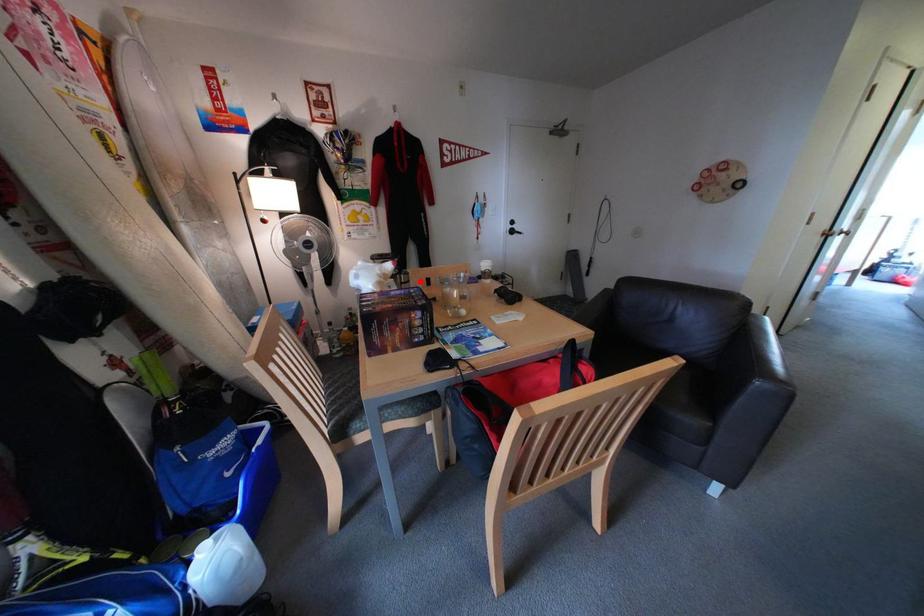
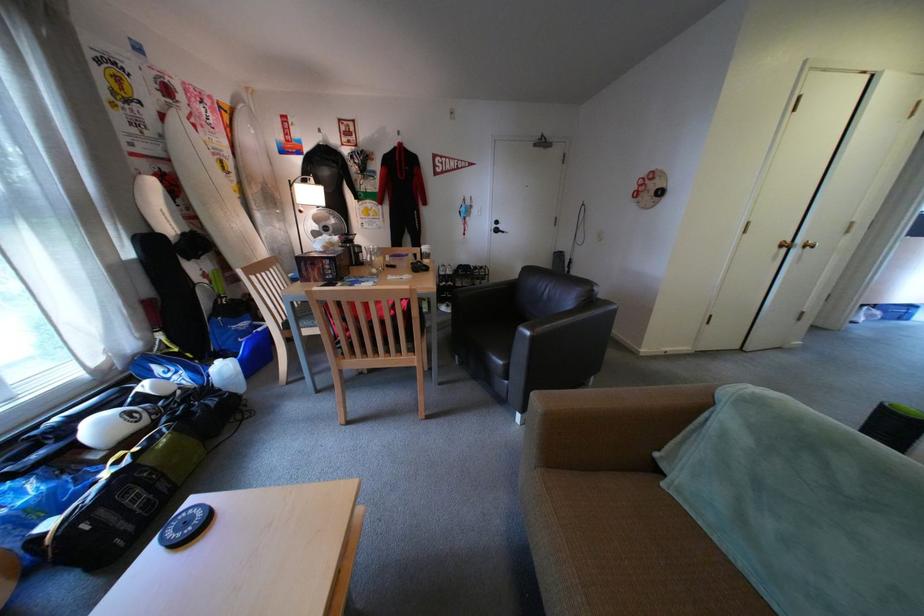
Question: I am providing you with two images of the same scene from different viewpoints. Given a red point in image1, look at the same physical point in image2. Is it:

Choices:
 (A) Closer to the viewpoint
 (B) Farther from the viewpoint

Answer: (A)